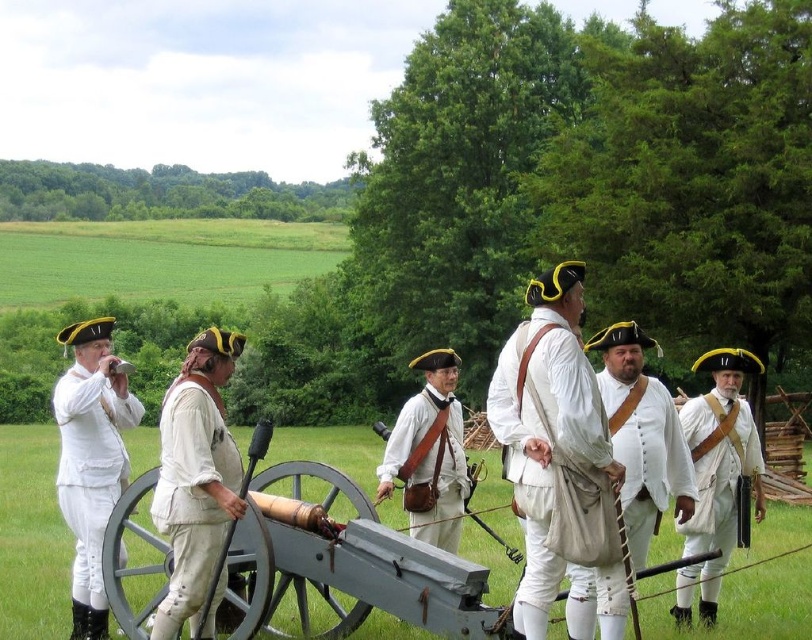
Question: Does white matte uniform at left appear on the left side of white linen coat at center?

Choices:
 (A) no
 (B) yes

Answer: (B)

Question: Among these objects, which one is nearest to the camera?

Choices:
 (A) white cotton shirt at center
 (B) white linen coat at center
 (C) white leather hat at center
 (D) white cotton coat at center

Answer: (D)

Question: Does white cotton coat at center have a greater width compared to white leather hat at center?

Choices:
 (A) no
 (B) yes

Answer: (B)

Question: Among these objects, which one is nearest to the camera?

Choices:
 (A) white matte uniform at left
 (B) white leather hat at center

Answer: (A)

Question: In this image, where is white linen coat at center located relative to white leather uniform at center?

Choices:
 (A) above
 (B) below

Answer: (A)

Question: Which point is closer to the camera?

Choices:
 (A) pyautogui.click(x=703, y=528)
 (B) pyautogui.click(x=392, y=444)
 (C) pyautogui.click(x=515, y=403)
 (D) pyautogui.click(x=76, y=620)

Answer: (C)